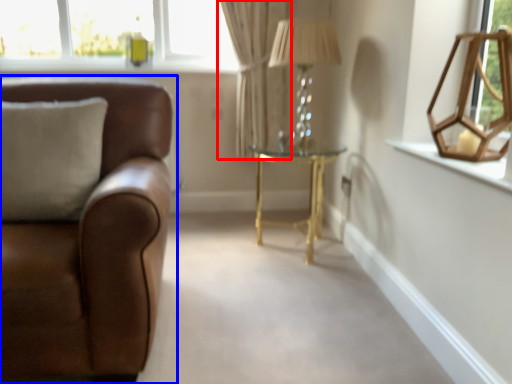
Question: Among these objects, which one is farthest to the camera, curtain (highlighted by a red box) or studio couch (highlighted by a blue box)?

Choices:
 (A) curtain
 (B) studio couch

Answer: (A)